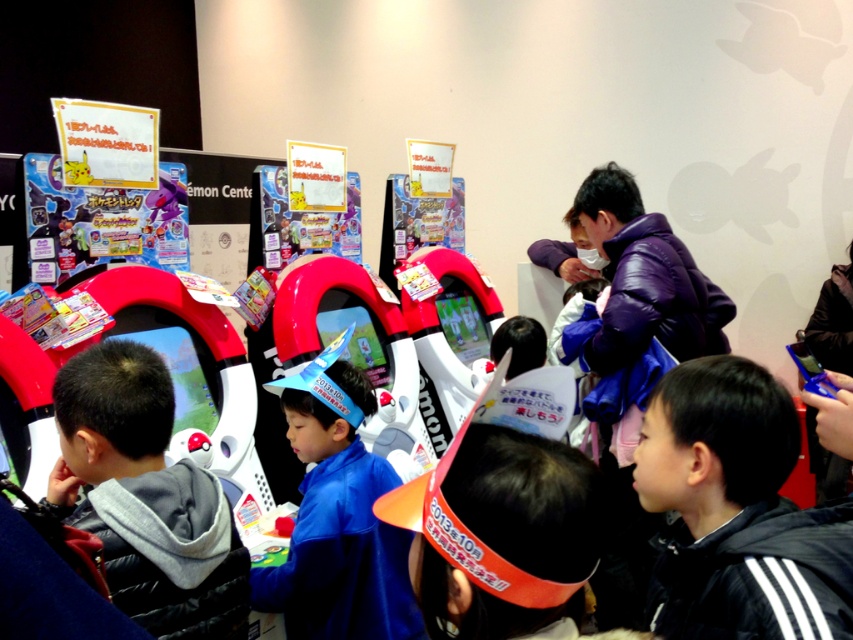
You are a photographer at the event and want to capture a photo of both the gray fleece jacket at left and the blue fabric hat at center in the same frame. The camera you have can only focus on objects within 17 inches of each other. Will both items be in focus?

The gray fleece jacket at left is 16.98 inches from the blue fabric hat at center, which is within the 17 inch focus range. Therefore, both items will be in focus.

You are organizing a photo shoot and need to ensure that the black fleece jacket at lower right and the blue fabric hat at center are visible in the frame. Given their sizes, which object might require you to adjust the camera angle to ensure it fits within the shot?

The black fleece jacket at lower right has a lesser width compared to the blue fabric hat at center, so the blue fabric hat at center might require adjusting the camera angle to ensure it fits within the shot since it is wider.